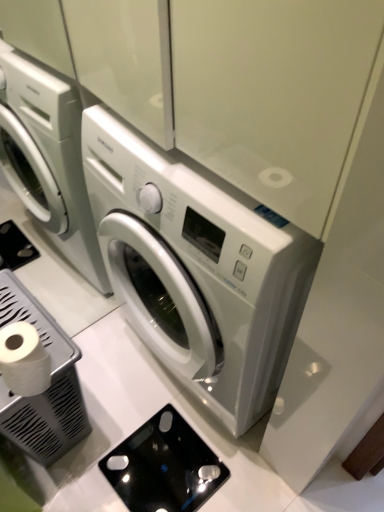
Describe the element at coordinates (197, 268) in the screenshot. I see `white glossy washing machine at center` at that location.

What is the approximate width of white glossy washing machine at center?

white glossy washing machine at center is 11.70 inches wide.

Locate an element on the screen. Image resolution: width=384 pixels, height=512 pixels. black glass scale at lower center, acting as the 2th appliance starting from the left is located at coordinates point(164,466).

What do you see at coordinates (24, 360) in the screenshot?
I see `white matte toilet paper at lower left` at bounding box center [24, 360].

You are a GUI agent. You are given a task and a screenshot of the screen. Output one action in this format:
    pyautogui.click(x=<x>, y=<y>)
    Task: Click on the white glossy washing machine at center
    Image resolution: width=384 pixels, height=512 pixels.
    Given the screenshot: What is the action you would take?
    pyautogui.click(x=197, y=268)

Does point (26, 369) come in front of point (228, 259)?

No, (26, 369) is behind (228, 259).

Which is in front, white matte toilet paper at lower left or white glossy washing machine at center?

white glossy washing machine at center is closer to the camera.

Who is smaller, white matte toilet paper at lower left or white glossy washing machine at center?

Smaller between the two is white matte toilet paper at lower left.

In terms of height, does white matte toilet paper at lower left look taller or shorter compared to white glossy washing machine at center?

Considering their sizes, white matte toilet paper at lower left has less height than white glossy washing machine at center.

From the picture: Measure the distance between black glass scale at lower center, which is the first appliance in right-to-left order, and white plastic trash can at lower left, which is counted as the first appliance, starting from the left.

The distance of black glass scale at lower center, which is the first appliance in right-to-left order, from white plastic trash can at lower left, which is counted as the first appliance, starting from the left, is 12.03 inches.

Is black glass scale at lower center, acting as the 2th appliance starting from the left, to the left of white plastic trash can at lower left, which is counted as the first appliance, starting from the left, from the viewer's perspective?

Incorrect, black glass scale at lower center, acting as the 2th appliance starting from the left, is not on the left side of white plastic trash can at lower left, which is counted as the first appliance, starting from the left.

Does point (127, 447) lie in front of point (24, 295)?

No, (127, 447) is further to viewer.

Where is `appliance in front of the black glass scale at lower center, acting as the 2th appliance starting from the left`? appliance in front of the black glass scale at lower center, acting as the 2th appliance starting from the left is located at coordinates (48, 388).

Is white glossy washing machine at center facing towards white matte toilet paper at lower left?

Yes, white glossy washing machine at center is facing white matte toilet paper at lower left.

Is white glossy washing machine at center to the left or to the right of white matte toilet paper at lower left in the image?

In the image, white glossy washing machine at center appears on the right side of white matte toilet paper at lower left.

From the picture: Are white glossy washing machine at center and white matte toilet paper at lower left beside each other?

white glossy washing machine at center is not next to white matte toilet paper at lower left, and they're not touching.

In terms of width, does white glossy washing machine at center look wider or thinner when compared to white matte toilet paper at lower left?

Considering their sizes, white glossy washing machine at center looks broader than white matte toilet paper at lower left.

Could you measure the distance between white plastic trash can at lower left, which is counted as the first appliance, starting from the left, and white glossy washing machine at center?

white plastic trash can at lower left, which is counted as the first appliance, starting from the left, is 14.76 inches from white glossy washing machine at center.

Does white plastic trash can at lower left, which is counted as the first appliance, starting from the left, have a greater width compared to white glossy washing machine at center?

In fact, white plastic trash can at lower left, which is counted as the first appliance, starting from the left, might be narrower than white glossy washing machine at center.

Which of these two, white plastic trash can at lower left, which ranks as the 2th appliance in right-to-left order, or white glossy washing machine at center, stands taller?

Standing taller between the two is white glossy washing machine at center.

How many degrees apart are the facing directions of white plastic trash can at lower left, which is counted as the first appliance, starting from the left, and white glossy washing machine at center?

180 degrees separate the facing orientations of white plastic trash can at lower left, which is counted as the first appliance, starting from the left, and white glossy washing machine at center.

Is white matte toilet paper at lower left thinner than white plastic trash can at lower left, which ranks as the 2th appliance in right-to-left order?

Yes, white matte toilet paper at lower left is thinner than white plastic trash can at lower left, which ranks as the 2th appliance in right-to-left order.

Is white matte toilet paper at lower left not near white plastic trash can at lower left, which is counted as the first appliance, starting from the left?

They are positioned close to each other.

Is point (4, 350) positioned in front of point (59, 449)?

Yes.

Is white matte toilet paper at lower left not inside white plastic trash can at lower left, which ranks as the 2th appliance in right-to-left order?

That's incorrect, white matte toilet paper at lower left is not completely outside white plastic trash can at lower left, which ranks as the 2th appliance in right-to-left order.

Is there a large distance between black glass scale at lower center, acting as the 2th appliance starting from the left, and white glossy washing machine at center?

No, black glass scale at lower center, acting as the 2th appliance starting from the left, is in close proximity to white glossy washing machine at center.

Is black glass scale at lower center, which is the first appliance in right-to-left order, taller or shorter than white glossy washing machine at center?

In the image, black glass scale at lower center, which is the first appliance in right-to-left order, appears to be shorter than white glossy washing machine at center.

Based on the photo, choose the correct answer: Is black glass scale at lower center, which is the first appliance in right-to-left order, inside white glossy washing machine at center or outside it?

black glass scale at lower center, which is the first appliance in right-to-left order, cannot be found inside white glossy washing machine at center.

From a real-world perspective, is white matte toilet paper at lower left on black glass scale at lower center, which is the first appliance in right-to-left order?

Yes, from a real-world perspective, white matte toilet paper at lower left is above black glass scale at lower center, which is the first appliance in right-to-left order.

Which point is more distant from viewer, [20,390] or [193,437]?

The point [193,437] is more distant.

Are white matte toilet paper at lower left and black glass scale at lower center, acting as the 2th appliance starting from the left, making contact?

No, white matte toilet paper at lower left is not next to black glass scale at lower center, acting as the 2th appliance starting from the left.

Considering the relative sizes of white matte toilet paper at lower left and black glass scale at lower center, acting as the 2th appliance starting from the left, in the image provided, is white matte toilet paper at lower left bigger than black glass scale at lower center, acting as the 2th appliance starting from the left,?

Yes, white matte toilet paper at lower left is bigger than black glass scale at lower center, acting as the 2th appliance starting from the left.

Locate an element on the screen. The height and width of the screenshot is (512, 384). toilet paper that is below the white glossy washing machine at center (from the image's perspective) is located at coordinates (24, 360).

Image resolution: width=384 pixels, height=512 pixels. What are the coordinates of `appliance located above the black glass scale at lower center, acting as the 2th appliance starting from the left (from a real-world perspective)` in the screenshot? It's located at (48, 388).

Based on their spatial positions, is black glass scale at lower center, acting as the 2th appliance starting from the left, or white glossy washing machine at center further from white matte toilet paper at lower left?

Among the two, black glass scale at lower center, acting as the 2th appliance starting from the left, is located further to white matte toilet paper at lower left.

Estimate the real-world distances between objects in this image. Which object is further from white glossy washing machine at center, white plastic trash can at lower left, which is counted as the first appliance, starting from the left, or white matte toilet paper at lower left?

white matte toilet paper at lower left is positioned further to the anchor white glossy washing machine at center.

When comparing their distances from white glossy washing machine at center, does black glass scale at lower center, which is the first appliance in right-to-left order, or white matte toilet paper at lower left seem further?

The object further to white glossy washing machine at center is black glass scale at lower center, which is the first appliance in right-to-left order.

From the image, which object appears to be farther from white matte toilet paper at lower left, white glossy washing machine at center or black glass scale at lower center, which is the first appliance in right-to-left order?

black glass scale at lower center, which is the first appliance in right-to-left order.

Looking at the image, which one is located further to white glossy washing machine at center, black glass scale at lower center, which is the first appliance in right-to-left order, or white plastic trash can at lower left, which is counted as the first appliance, starting from the left?

Among the two, black glass scale at lower center, which is the first appliance in right-to-left order, is located further to white glossy washing machine at center.

Looking at the image, which one is located closer to black glass scale at lower center, acting as the 2th appliance starting from the left, white glossy washing machine at center or white matte toilet paper at lower left?

The object closer to black glass scale at lower center, acting as the 2th appliance starting from the left, is white glossy washing machine at center.

Looking at the image, which one is located further to black glass scale at lower center, acting as the 2th appliance starting from the left, white plastic trash can at lower left, which ranks as the 2th appliance in right-to-left order, or white matte toilet paper at lower left?

The object further to black glass scale at lower center, acting as the 2th appliance starting from the left, is white matte toilet paper at lower left.

Estimate the real-world distances between objects in this image. Which object is closer to white plastic trash can at lower left, which is counted as the first appliance, starting from the left, black glass scale at lower center, which is the first appliance in right-to-left order, or white matte toilet paper at lower left?

Based on the image, white matte toilet paper at lower left appears to be nearer to white plastic trash can at lower left, which is counted as the first appliance, starting from the left.

This screenshot has width=384, height=512. What are the coordinates of `appliance between white glossy washing machine at center and black glass scale at lower center, which is the first appliance in right-to-left order, in the vertical direction` in the screenshot? It's located at (48, 388).

Locate an element on the screen. This screenshot has height=512, width=384. toilet paper between white plastic trash can at lower left, which is counted as the first appliance, starting from the left, and white glossy washing machine at center from left to right is located at coordinates (24, 360).

The width and height of the screenshot is (384, 512). I want to click on toilet paper between white glossy washing machine at center and black glass scale at lower center, acting as the 2th appliance starting from the left, vertically, so click(x=24, y=360).

At what (x,y) coordinates should I click in order to perform the action: click on appliance between white matte toilet paper at lower left and black glass scale at lower center, acting as the 2th appliance starting from the left, in the up-down direction. Please return your answer as a coordinate pair (x, y). Looking at the image, I should click on (48, 388).